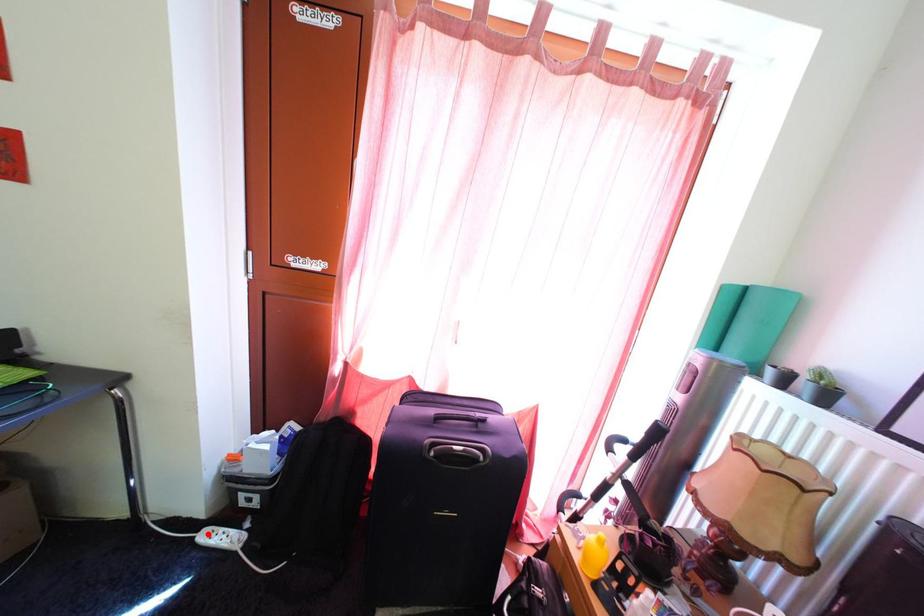
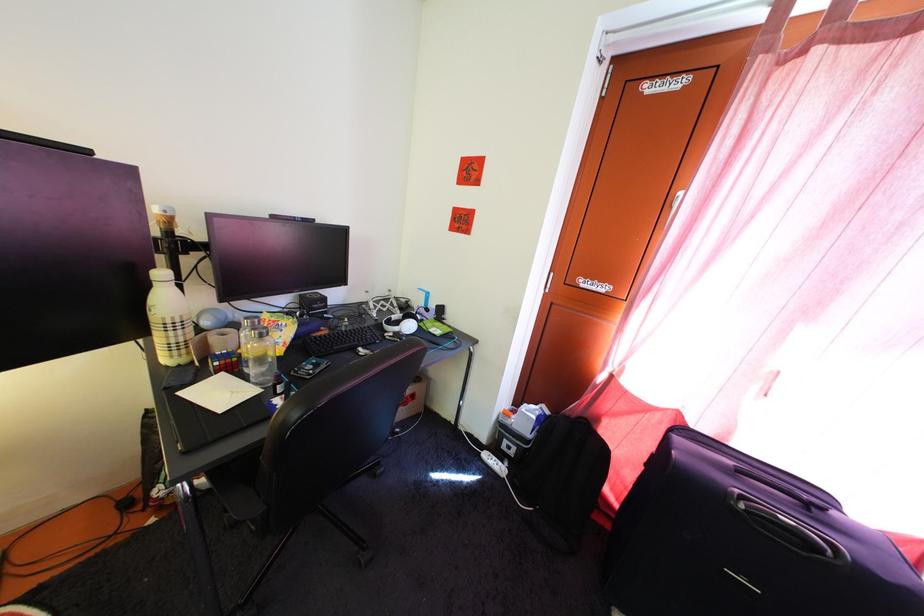
Question: I am providing you with two images of the same scene from different viewpoints. A red point is shown in image1. For the corresponding object point in image2, is it positioned nearer or farther from the camera?

Choices:
 (A) Nearer
 (B) Farther

Answer: (B)